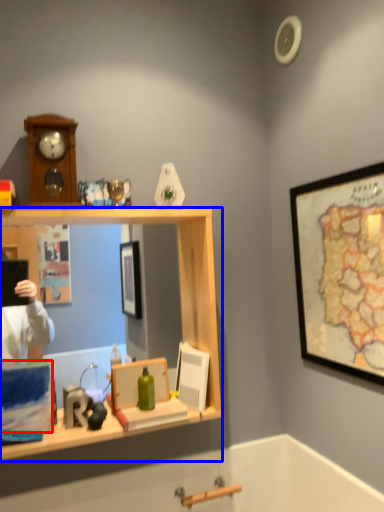
Question: Which object appears closest to the camera in this image, box (highlighted by a red box) or desk (highlighted by a blue box)?

Choices:
 (A) box
 (B) desk

Answer: (B)